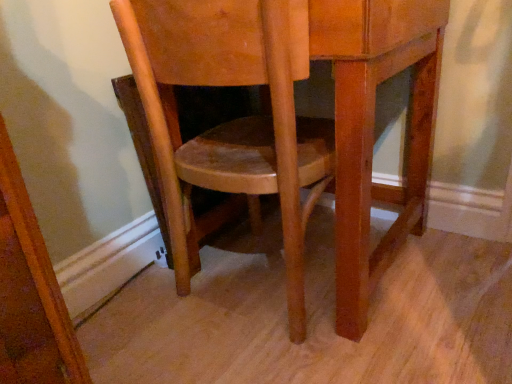
Locate an element on the screen. The width and height of the screenshot is (512, 384). wooden chair at center is located at coordinates (233, 120).

What do you see at coordinates (233, 120) in the screenshot?
I see `wooden chair at center` at bounding box center [233, 120].

Identify the location of wooden chair at center. (233, 120).